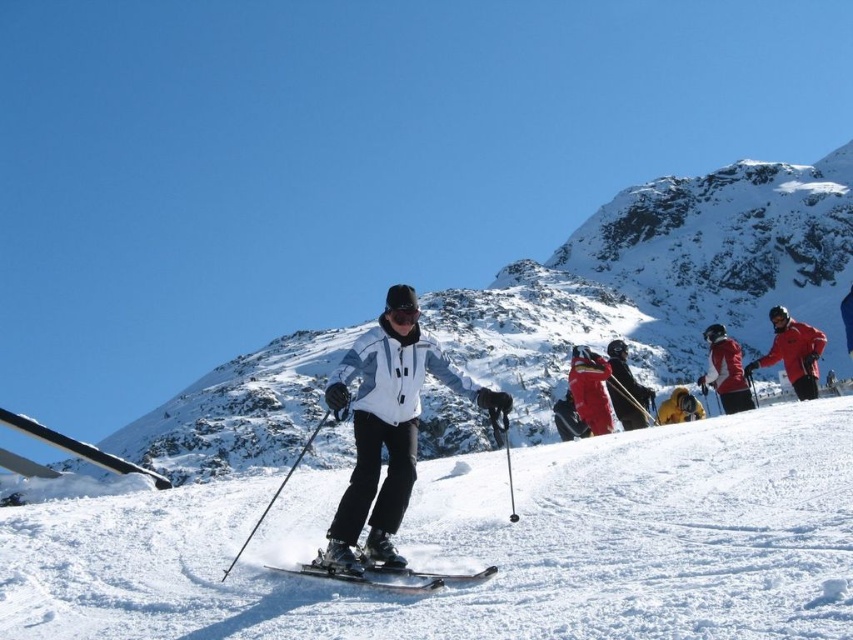
Question: Does red matte jacket at center have a greater width compared to yellow fabric jacket at center?

Choices:
 (A) yes
 (B) no

Answer: (A)

Question: Is white snow ski slope at center closer to camera compared to matte red ski suit at center?

Choices:
 (A) no
 (B) yes

Answer: (B)

Question: Can you confirm if white snow mountain at center is positioned below white matte jacket at center?

Choices:
 (A) yes
 (B) no

Answer: (B)

Question: Which of the following is the farthest from the observer?

Choices:
 (A) (664, 269)
 (B) (618, 374)

Answer: (A)

Question: Which point appears closest to the camera in this image?

Choices:
 (A) (730, 376)
 (B) (810, 358)
 (C) (618, 371)

Answer: (B)

Question: Which point is closer to the camera taking this photo?

Choices:
 (A) (363, 417)
 (B) (664, 413)

Answer: (A)